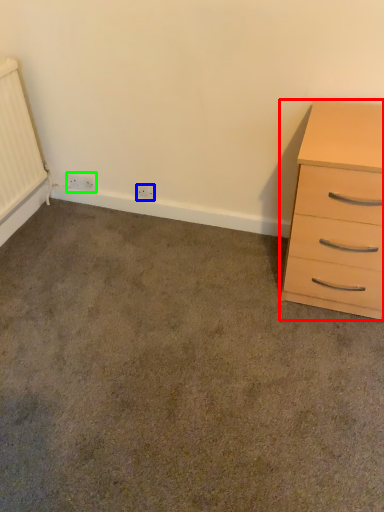
Question: Estimate the real-world distances between objects in this image. Which object is farther from chest of drawers (highlighted by a red box), electric outlet (highlighted by a blue box) or electric outlet (highlighted by a green box)?

Choices:
 (A) electric outlet
 (B) electric outlet

Answer: (B)